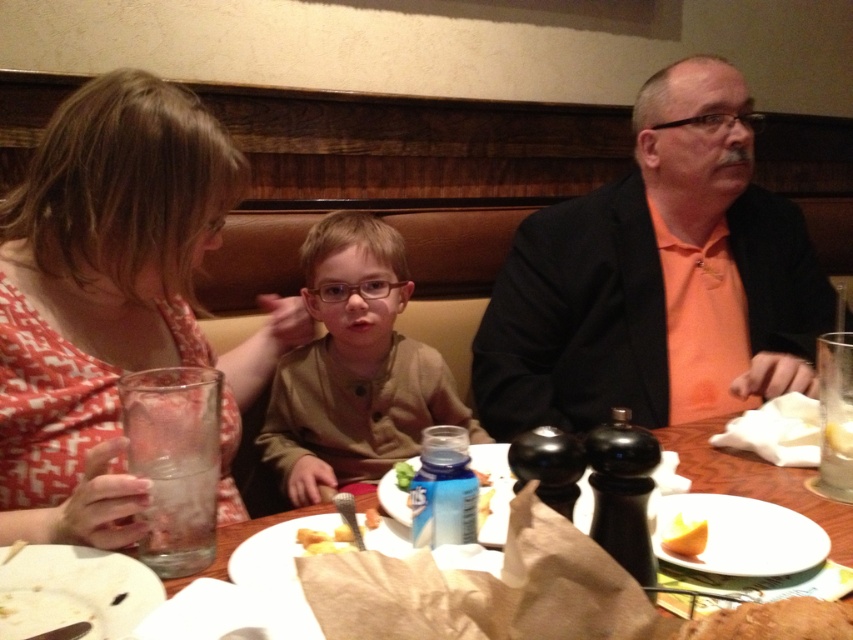
You are a waiter in a restaurant and need to place a new dish on the table. The table has a clear glass at center. Where should you place the dish to avoid covering the glass? Please provide coordinates in the format of point coordinates like point [486,589].

The clear glass at center is located at point [486,589]. To avoid covering it, place the dish elsewhere on the table, such as point 0.7, 0.3.

You are sitting at the table in the family dining scene. You want to reach for an item located at point A and another at point B. If point A is at coordinates point (784, 259) and point B is at point (445, 582), which point is closer to you?

Point B at point (445, 582) is closer to you because point A at point (784, 259) is behind it.

You are a server at the restaurant and need to place a new drink order on the table. The table has an orange matte jacket at upper right and a clear glass at center. Which object should you avoid placing the drink near to ensure it doesn

The orange matte jacket at upper right has a greater width than the clear glass at center. Since the jacket is wider, placing the drink near it might not leave enough space. Avoid placing the drink near the orange matte jacket at upper right to ensure sufficient space.